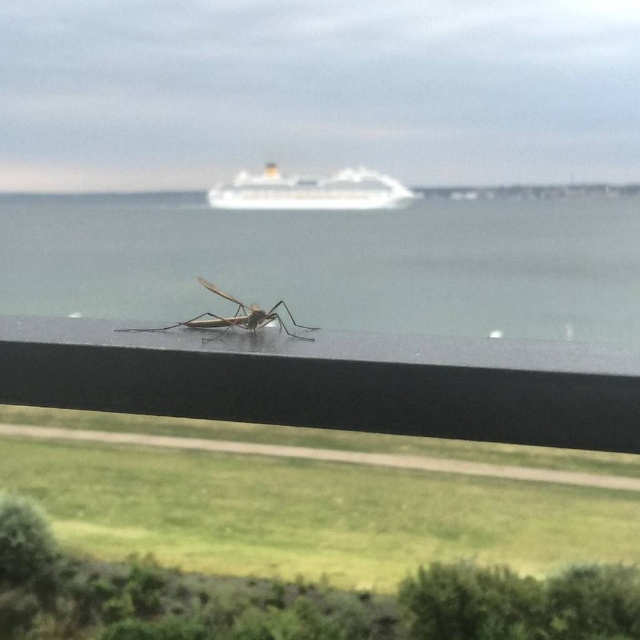
You are an observer looking through the window. You see the clear glass water at center and the translucent brown mosquito at center. Which object is located to the right of the other?

The clear glass water at center is positioned on the right side of the translucent brown mosquito at center.

You are standing in front of a window where a mosquito is resting on the edge. You notice a point marked at coordinates (333, 262) which indicates clear glass water at center. Can you determine if the mosquito is closer to the window compared to the clear glass water at center?

The point (333, 262) marks clear glass water at center, so the mosquito on the edge of the window is closer to the observer than the clear glass water at center because it is perched on the window itself.